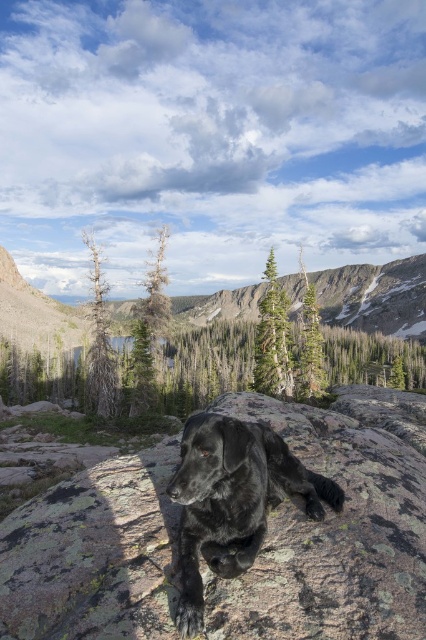
You are a photographer trying to capture the rough granite boulder at center and the shiny black dog at center in a single shot. Based on their positions, which object should you focus on first to ensure both are in sharp focus?

The rough granite boulder at center is below the shiny black dog at center, so you should focus on the rough granite boulder at center first to ensure both are in sharp focus.

You are a photographer trying to capture the rough granite boulder at center and the shiny black dog at center in the same frame. Based on their sizes, which object should you focus on first to ensure both are in focus?

The rough granite boulder at center is taller than the shiny black dog at center, so you should focus on the rough granite boulder at center first to ensure both are in focus.

You are planning to place a small picnic basket on the rough granite boulder at center. Considering the size of the boulder and the dog, will the basket fit without the shiny black dog at center disturbing it?

The rough granite boulder at center might be wider than the shiny black dog at center, so the picnic basket could fit on the boulder without the dog disturbing it if the boulder has enough space. However, since the dog is already lying on the boulder, you may need to consider its position to ensure the basket stays stable and the dog doesn